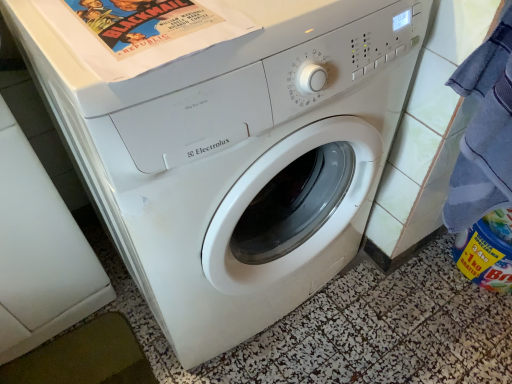
The width and height of the screenshot is (512, 384). I want to click on blue striped towel at right, so click(484, 131).

What do you see at coordinates (484, 131) in the screenshot?
I see `blue striped towel at right` at bounding box center [484, 131].

At what (x,y) coordinates should I click in order to perform the action: click on blue striped towel at right. Please return your answer as a coordinate pair (x, y). Image resolution: width=512 pixels, height=384 pixels. Looking at the image, I should click on (484, 131).